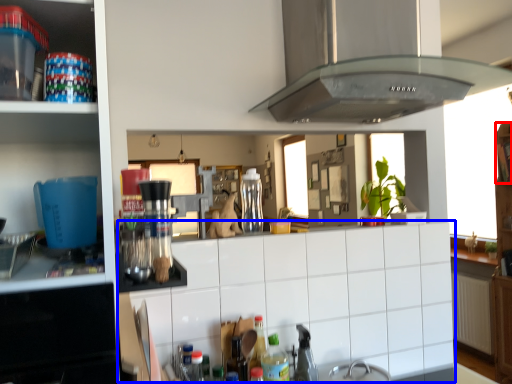
Question: Which point is closer to the camera, shelf (highlighted by a red box) or counter top (highlighted by a blue box)?

Choices:
 (A) shelf
 (B) counter top

Answer: (B)